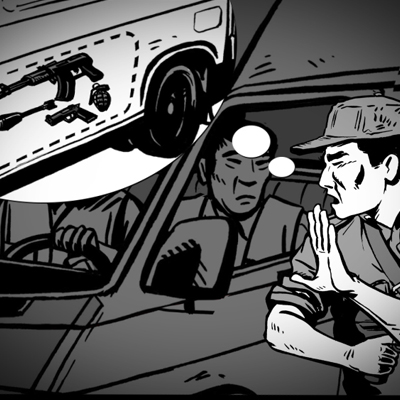
Where is `mirror`? Image resolution: width=400 pixels, height=400 pixels. mirror is located at coordinates (211, 263).